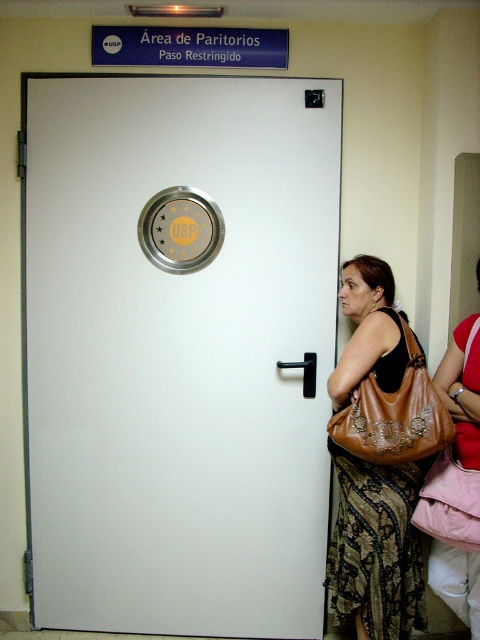
Does point (179, 294) come in front of point (416, 435)?

No.

Does white glossy door at center have a smaller size compared to brown leather bag at right?

No, white glossy door at center is not smaller than brown leather bag at right.

Locate an element on the screen. white glossy door at center is located at coordinates (180, 349).

Who is positioned more to the right, white glossy door at center or brown leather purse at right?

brown leather purse at right is more to the right.

Who is higher up, white glossy door at center or brown leather purse at right?

white glossy door at center

The height and width of the screenshot is (640, 480). I want to click on white glossy door at center, so click(180, 349).

Find the location of `white glossy door at center`. white glossy door at center is located at coordinates (180, 349).

Is point (351, 540) farther from camera compared to point (406, 433)?

Yes.

Which is in front, point (391, 600) or point (406, 342)?

Point (391, 600)

Between point (368, 541) and point (380, 403), which one is positioned in front?

Point (380, 403) is more forward.

What are the coordinates of `brown leather purse at right` in the screenshot? It's located at (375, 547).